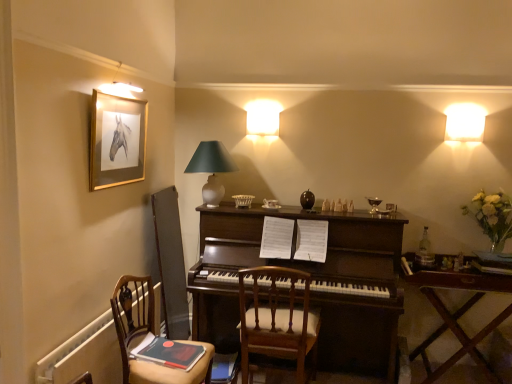
Locate an element on the screen. The width and height of the screenshot is (512, 384). free spot above wooden table at right (from a real-world perspective) is located at coordinates (456, 269).